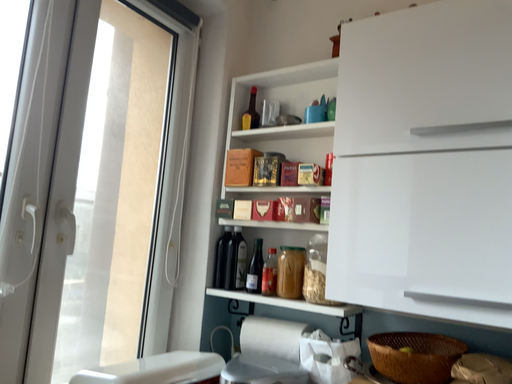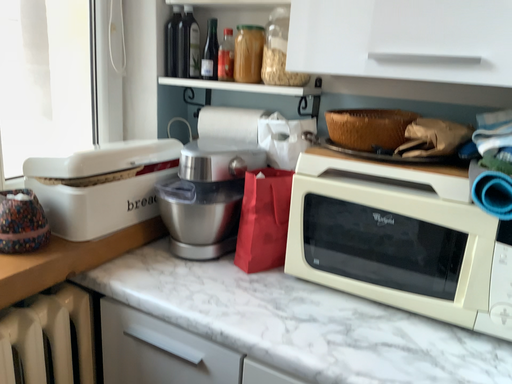
Question: How did the camera likely rotate when shooting the video?

Choices:
 (A) rotated left
 (B) rotated right

Answer: (B)